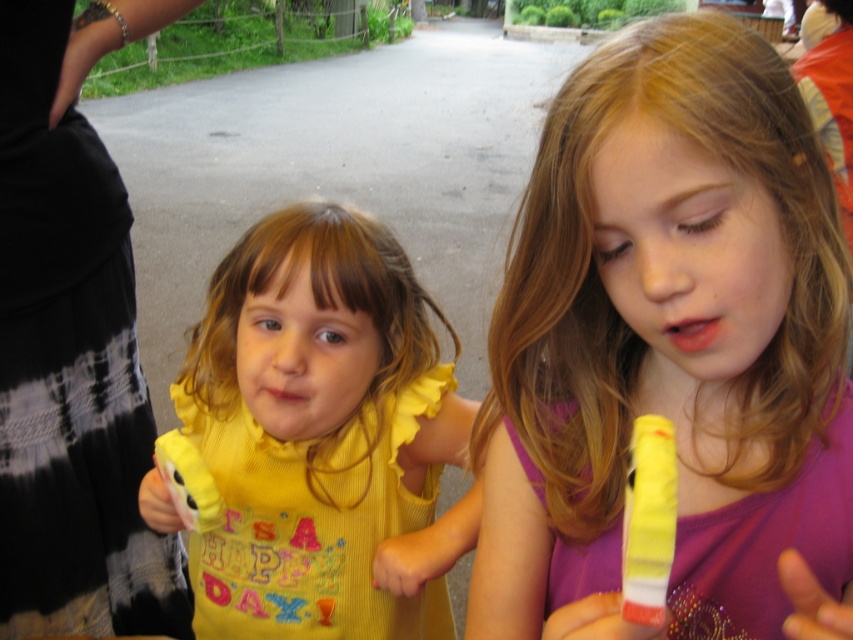
You are a photographer standing at a certain distance from the purple shiny dress at center. If you want to take a closer photo without moving the dress, what should you do?

Since the distance between the purple shiny dress at center and the camera is 16.90 inches, you can move closer to the dress or use a zoom lens to reduce the distance in the photo.

You are a parent trying to choose between two yellow items for your child. The yellow fabric dress at center and the yellow plastic toy at right. Which one is bigger?

The yellow fabric dress at center is larger in size compared to the yellow plastic toy at right.